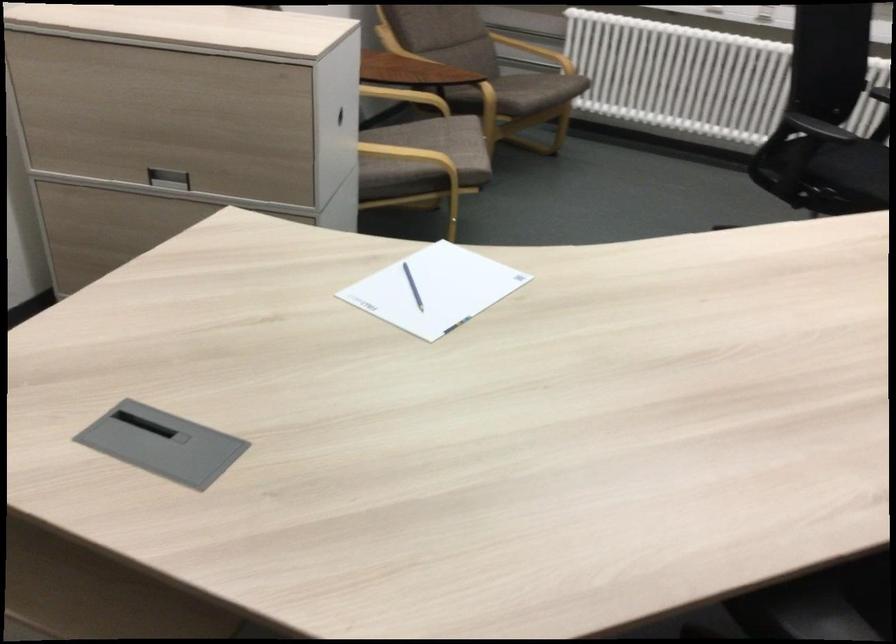
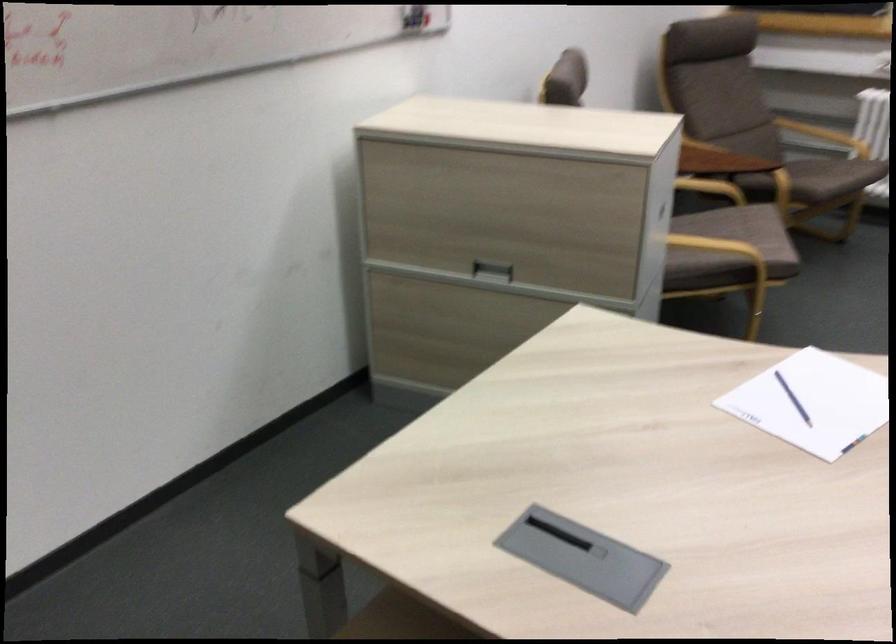
Where in the second image is the point corresponding to (417,161) from the first image?

(721, 249)